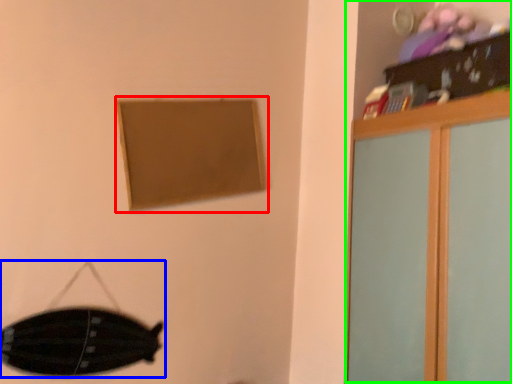
Question: Based on their relative distances, which object is nearer to picture frame (highlighted by a red box)? Choose from swivel chair (highlighted by a blue box) and dresser (highlighted by a green box).

Choices:
 (A) swivel chair
 (B) dresser

Answer: (A)